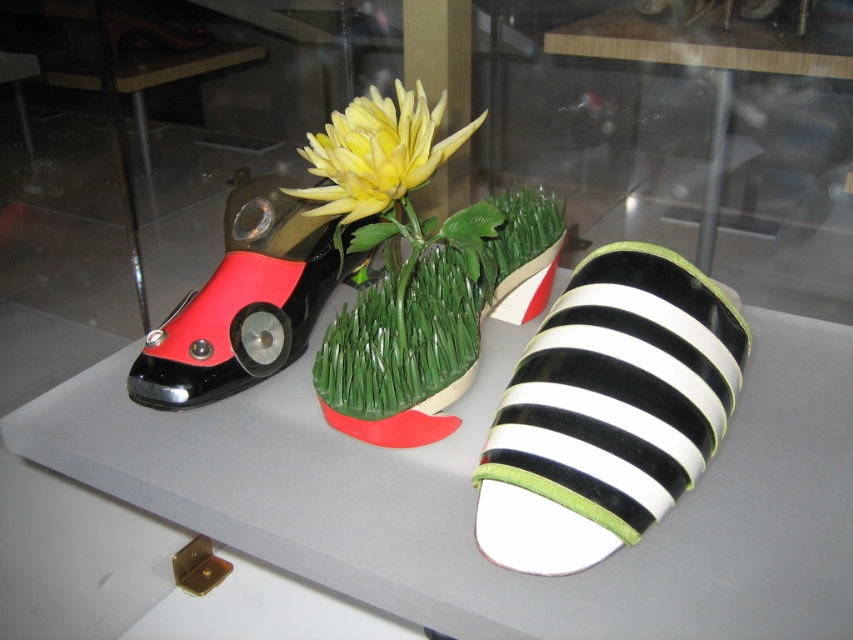
You are a photographer setting up a shoot in the scene described. You need to ensure that the black and white striped sandal at center is visible above the green grass at center. Based on their heights, will this arrangement naturally occur?

The black and white striped sandal at center has a greater height compared to green grass at center, so yes, the sandal will naturally be visible above the grass.

You are a delivery robot with a 6 inch wide package. You need to place the package between the black and white striped sandal at center and the green grass at center. Is there enough space for the package?

The distance between the black and white striped sandal at center and the green grass at center is 8.08 inches. Since the package is 6 inches wide, there is enough space to place it between them.